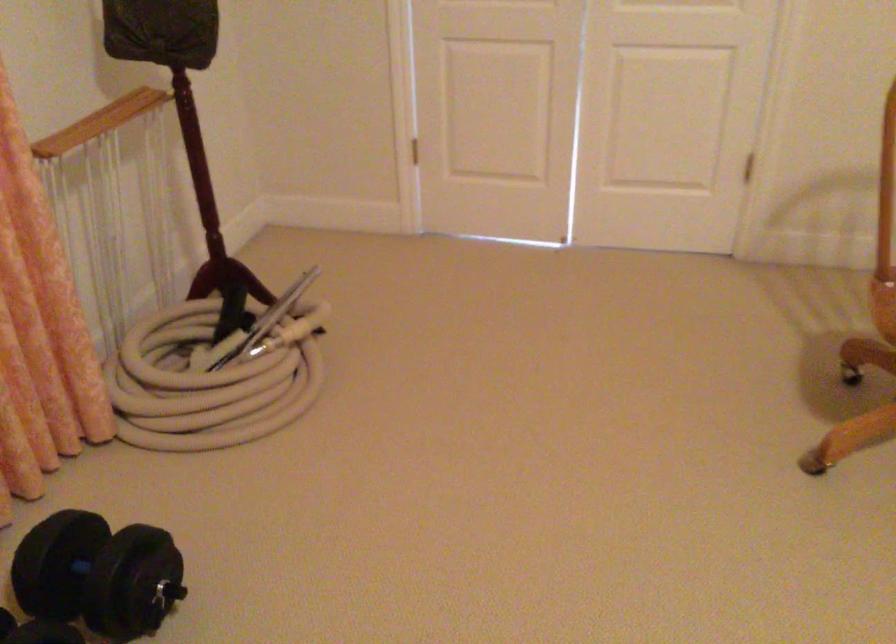
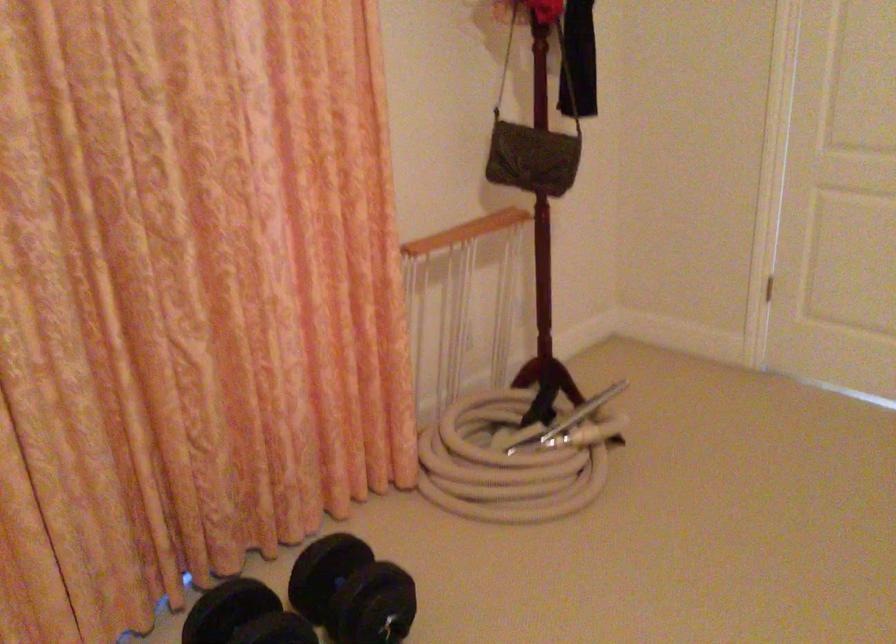
Question: Based on the continuous images, in which direction is the camera rotating? Reply with the corresponding letter.

Choices:
 (A) Left
 (B) Right
 (C) Up
 (D) Down

Answer: (A)